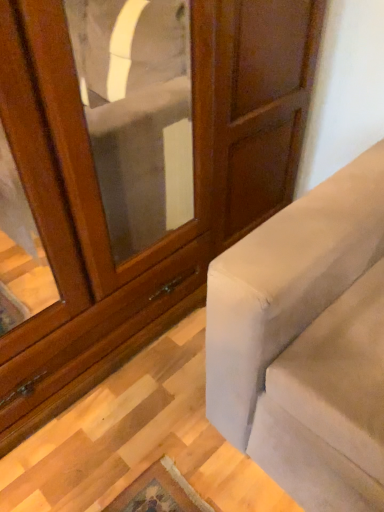
At what (x,y) coordinates should I click in order to perform the action: click on suede-like beige studio couch at right. Please return your answer as a coordinate pair (x, y). The image size is (384, 512). Looking at the image, I should click on click(306, 342).

What do you see at coordinates (306, 342) in the screenshot?
I see `suede-like beige studio couch at right` at bounding box center [306, 342].

You are a GUI agent. You are given a task and a screenshot of the screen. Output one action in this format:
    pyautogui.click(x=<x>, y=<y>)
    Task: Click on the suede-like beige studio couch at right
    
    Given the screenshot: What is the action you would take?
    pyautogui.click(x=306, y=342)